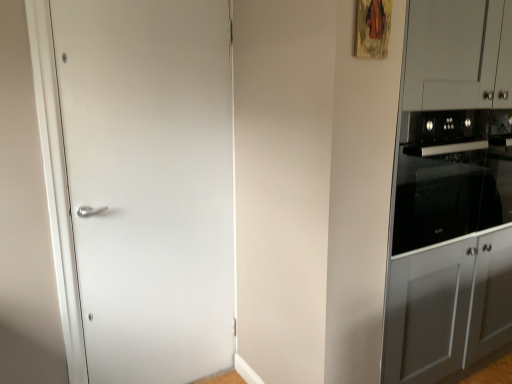
Looking at this image, what is the approximate height of black glass oven at right?

black glass oven at right is 23.04 inches tall.

The image size is (512, 384). I want to click on white matte door at left, so click(150, 183).

Is black glass oven at right placed right next to white matte door at left?

black glass oven at right and white matte door at left are not in contact.

From the image's perspective, which is below, black glass oven at right or white matte door at left?

From the image's view, white matte door at left is below.

Find the location of `home appliance on the right of white matte door at left`. home appliance on the right of white matte door at left is located at coordinates [x=451, y=176].

Is black glass oven at right shorter than white matte door at left?

Yes, black glass oven at right is shorter than white matte door at left.

You are a GUI agent. You are given a task and a screenshot of the screen. Output one action in this format:
    pyautogui.click(x=<x>, y=<y>)
    Task: Click on the home appliance above the satin gray cabinet at right (from a real-world perspective)
    
    Given the screenshot: What is the action you would take?
    pyautogui.click(x=451, y=176)

Does black glass oven at right have a greater width compared to satin gray cabinet at right?

No.

In the scene shown: From a real-world perspective, who is located lower, black glass oven at right or satin gray cabinet at right?

From a 3D spatial view, satin gray cabinet at right is below.

Could you tell me if satin gray cabinet at right is facing white matte door at left?

No, satin gray cabinet at right is not oriented towards white matte door at left.

Can you confirm if satin gray cabinet at right is bigger than white matte door at left?

Indeed, satin gray cabinet at right has a larger size compared to white matte door at left.

Does point (453, 91) appear closer or farther from the camera than point (152, 226)?

Clearly, point (453, 91) is closer to the camera than point (152, 226).

Considering the sizes of satin gray cabinet at right and white matte door at left in the image, is satin gray cabinet at right wider or thinner than white matte door at left?

Considering their sizes, satin gray cabinet at right looks broader than white matte door at left.

Who is bigger, white matte door at left or black glass oven at right?

Bigger between the two is black glass oven at right.

Does white matte door at left have a lesser height compared to black glass oven at right?

No.

Is white matte door at left at the right side of black glass oven at right?

No.

From the image's perspective, between white matte door at left and black glass oven at right, who is located below?

white matte door at left appears lower in the image.

Is white matte door at left spatially inside satin gray cabinet at right, or outside of it?

white matte door at left is located beyond the bounds of satin gray cabinet at right.

Considering the relative positions of white matte door at left and satin gray cabinet at right in the image provided, is white matte door at left to the right of satin gray cabinet at right from the viewer's perspective?

No.

Between white matte door at left and satin gray cabinet at right, which one has larger size?

With larger size is satin gray cabinet at right.

Is white matte door at left oriented away from satin gray cabinet at right?

white matte door at left is not turned away from satin gray cabinet at right.

Which object is further away from the camera taking this photo, satin gray cabinet at right or black glass oven at right?

black glass oven at right is behind.

Does satin gray cabinet at right have a smaller size compared to black glass oven at right?

No.

Which is less distant, (454, 109) or (473, 207)?

The point (454, 109) is in front.

Can you tell me how much satin gray cabinet at right and black glass oven at right differ in facing direction?

The angular difference between satin gray cabinet at right and black glass oven at right is 0.000139 degrees.

Locate an element on the screen. The height and width of the screenshot is (384, 512). home appliance on the right side of white matte door at left is located at coordinates (451, 176).

The height and width of the screenshot is (384, 512). Identify the location of dresser that is below the black glass oven at right (from the image's perspective). (451, 192).

From the image, which object appears to be farther from black glass oven at right, white matte door at left or satin gray cabinet at right?

white matte door at left.

From the image, which object appears to be nearer to white matte door at left, satin gray cabinet at right or black glass oven at right?

satin gray cabinet at right.

From the image, which object appears to be nearer to black glass oven at right, satin gray cabinet at right or white matte door at left?

The object closer to black glass oven at right is satin gray cabinet at right.

Considering their positions, is white matte door at left positioned closer to satin gray cabinet at right than black glass oven at right?

black glass oven at right lies closer to satin gray cabinet at right than the other object.

From the image, which object appears to be farther from white matte door at left, black glass oven at right or satin gray cabinet at right?

Based on the image, black glass oven at right appears to be further to white matte door at left.

Estimate the real-world distances between objects in this image. Which object is closer to satin gray cabinet at right, black glass oven at right or white matte door at left?

black glass oven at right is closer to satin gray cabinet at right.

Find the location of a particular element. dresser between white matte door at left and black glass oven at right in the horizontal direction is located at coordinates (451, 192).